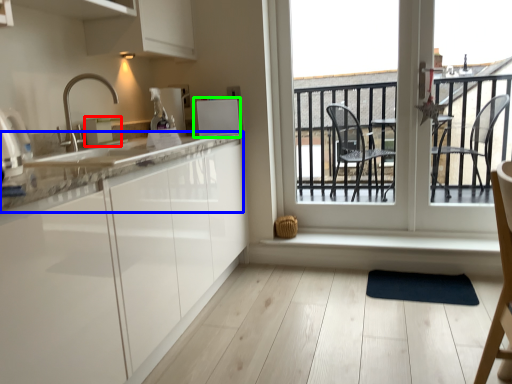
Question: Which is farther away from appliance (highlighted by a red box)? countertop (highlighted by a blue box) or appliance (highlighted by a green box)?

Choices:
 (A) countertop
 (B) appliance

Answer: (A)